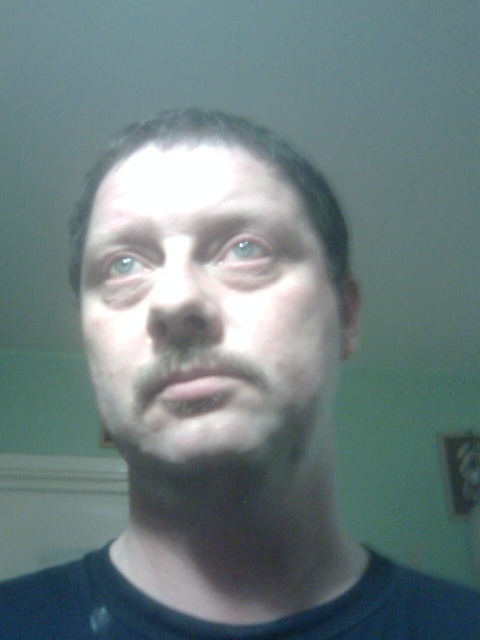
Can you confirm if gray matte eyebrow at upper left is wider than blue matte eye at upper left?

Indeed, gray matte eyebrow at upper left has a greater width compared to blue matte eye at upper left.

How distant is gray matte eyebrow at upper left from blue matte eye at upper left?

gray matte eyebrow at upper left and blue matte eye at upper left are 0.23 inches apart.

Which is in front, point (120, 246) or point (132, 268)?

Point (132, 268) is in front.

Locate an element on the screen. This screenshot has height=640, width=480. gray matte eyebrow at upper left is located at coordinates (130, 252).

Is blue matte eye at center smaller than blue matte eye at upper left?

No, blue matte eye at center is not smaller than blue matte eye at upper left.

Does point (218, 259) lie in front of point (133, 268)?

That is True.

What are the coordinates of `blue matte eye at center` in the screenshot? It's located at (245, 253).

In the scene shown: Who is shorter, matte skin face at center or blue matte eye at upper left?

blue matte eye at upper left

Can you confirm if matte skin face at center is positioned above blue matte eye at upper left?

No, matte skin face at center is not above blue matte eye at upper left.

This screenshot has width=480, height=640. What are the coordinates of `matte skin face at center` in the screenshot? It's located at (206, 308).